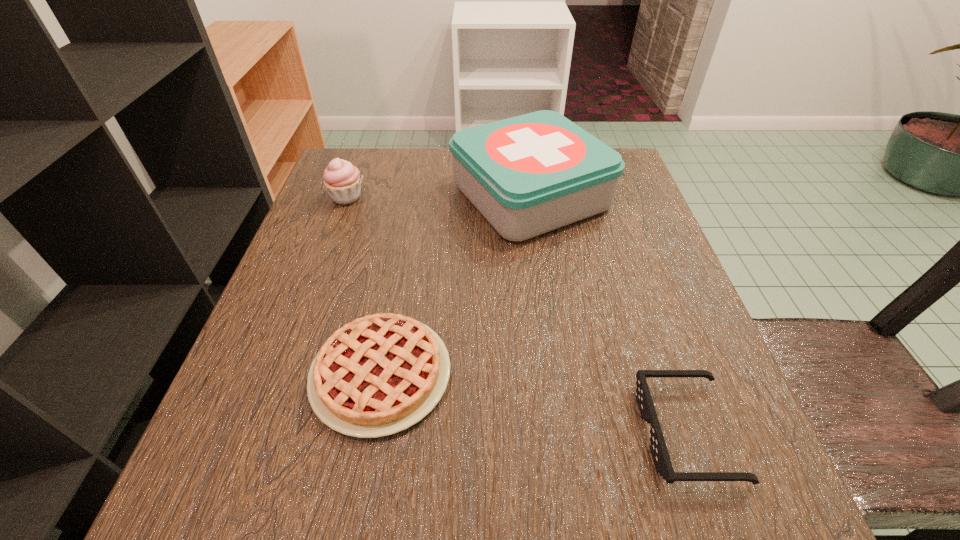
Find the location of `object that is at the near right corner`. object that is at the near right corner is located at coordinates (659, 451).

Locate an element on the screen. The width and height of the screenshot is (960, 540). blank area at the far edge is located at coordinates (422, 173).

This screenshot has height=540, width=960. In order to click on vacant area at the near edge of the desktop in this screenshot , I will do `click(556, 507)`.

The image size is (960, 540). In the image, there is a desktop. In order to click on blank space at the left edge in this screenshot , I will do `click(279, 338)`.

The image size is (960, 540). What are the coordinates of `free space at the right edge of the desktop` in the screenshot? It's located at (588, 240).

Image resolution: width=960 pixels, height=540 pixels. In the image, there is a desktop. Identify the location of free space at the far left corner. (374, 154).

Identify the location of vacant space at the near left corner. The width and height of the screenshot is (960, 540). (236, 501).

This screenshot has width=960, height=540. In the image, there is a desktop. Identify the location of vacant space at the near right corner. (662, 488).

Find the location of a particular element. free space that is in between the leftmost object and the sunglasses is located at coordinates (516, 315).

The height and width of the screenshot is (540, 960). Identify the location of vacant point located between the sunglasses and the pie. (534, 403).